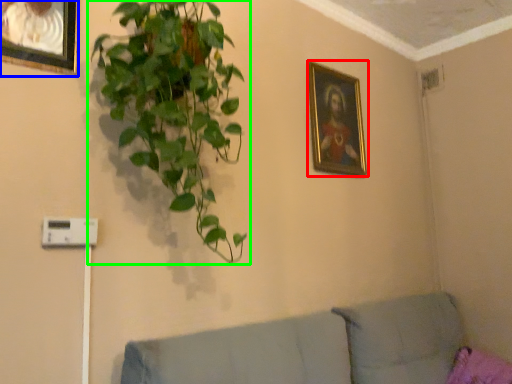
Question: Which object is positioned farthest from picture frame (highlighted by a red box)? Select from picture frame (highlighted by a blue box) and houseplant (highlighted by a green box).

Choices:
 (A) picture frame
 (B) houseplant

Answer: (A)